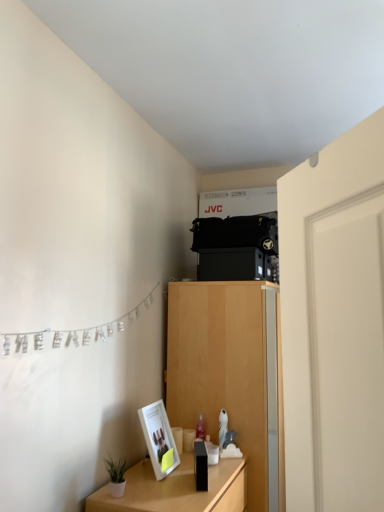
Question: From the image's perspective, is wooden table at lower left located above or below light wood cabinet at center?

Choices:
 (A) below
 (B) above

Answer: (A)

Question: Relative to light wood cabinet at center, is wooden table at lower left in front or behind?

Choices:
 (A) behind
 (B) front

Answer: (B)

Question: Estimate the real-world distances between objects in this image. Which object is closer to the white smooth door at right?

Choices:
 (A) silver metallic banner at left
 (B) wooden table at lower left
 (C) matte white picture frame at lower left
 (D) light wood cabinet at center

Answer: (A)

Question: Which of these objects is positioned farthest from the wooden table at lower left?

Choices:
 (A) light wood cabinet at center
 (B) matte white picture frame at lower left
 (C) silver metallic banner at left
 (D) white smooth door at right

Answer: (D)